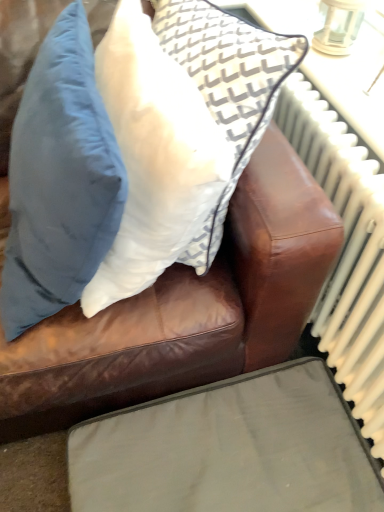
Question: From a real-world perspective, is matte gray cushion at lower center below white fabric pillow at upper center, the first pillow viewed from the right?

Choices:
 (A) yes
 (B) no

Answer: (A)

Question: Is the depth of matte gray cushion at lower center greater than that of white fabric pillow at upper center, which is counted as the 2th pillow, starting from the left?

Choices:
 (A) no
 (B) yes

Answer: (B)

Question: Is matte gray cushion at lower center smaller than white fabric pillow at upper center, which is counted as the 2th pillow, starting from the left?

Choices:
 (A) yes
 (B) no

Answer: (A)

Question: Would you say matte gray cushion at lower center is outside white fabric pillow at upper center, the first pillow viewed from the right?

Choices:
 (A) no
 (B) yes

Answer: (B)

Question: Considering the relative sizes of matte gray cushion at lower center and white fabric pillow at upper center, the first pillow viewed from the right, in the image provided, is matte gray cushion at lower center taller than white fabric pillow at upper center, the first pillow viewed from the right,?

Choices:
 (A) no
 (B) yes

Answer: (A)

Question: From a real-world perspective, is matte blue pillow at upper left, the first pillow from the left, physically located above or below matte gray cushion at lower center?

Choices:
 (A) above
 (B) below

Answer: (A)

Question: From the image's perspective, relative to matte gray cushion at lower center, is matte blue pillow at upper left, placed as the 2th pillow when sorted from right to left, above or below?

Choices:
 (A) below
 (B) above

Answer: (B)

Question: Considering the positions of matte blue pillow at upper left, placed as the 2th pillow when sorted from right to left, and matte gray cushion at lower center in the image, is matte blue pillow at upper left, placed as the 2th pillow when sorted from right to left, bigger or smaller than matte gray cushion at lower center?

Choices:
 (A) small
 (B) big

Answer: (B)

Question: From their relative heights in the image, would you say matte blue pillow at upper left, placed as the 2th pillow when sorted from right to left, is taller or shorter than matte gray cushion at lower center?

Choices:
 (A) tall
 (B) short

Answer: (A)

Question: Is matte gray cushion at lower center inside the boundaries of matte blue pillow at upper left, the first pillow from the left, or outside?

Choices:
 (A) inside
 (B) outside

Answer: (B)

Question: Is matte gray cushion at lower center wider or thinner than matte blue pillow at upper left, placed as the 2th pillow when sorted from right to left?

Choices:
 (A) wide
 (B) thin

Answer: (A)

Question: Is point (178, 426) closer or farther from the camera than point (54, 288)?

Choices:
 (A) closer
 (B) farther

Answer: (B)

Question: Relative to matte blue pillow at upper left, the first pillow from the left, is matte gray cushion at lower center in front or behind?

Choices:
 (A) front
 (B) behind

Answer: (B)

Question: Looking at their shapes, would you say matte blue pillow at upper left, placed as the 2th pillow when sorted from right to left, is wider or thinner than white fabric pillow at upper center, the first pillow viewed from the right?

Choices:
 (A) thin
 (B) wide

Answer: (B)

Question: Is matte blue pillow at upper left, the first pillow from the left, spatially inside white fabric pillow at upper center, the first pillow viewed from the right, or outside of it?

Choices:
 (A) inside
 (B) outside

Answer: (B)